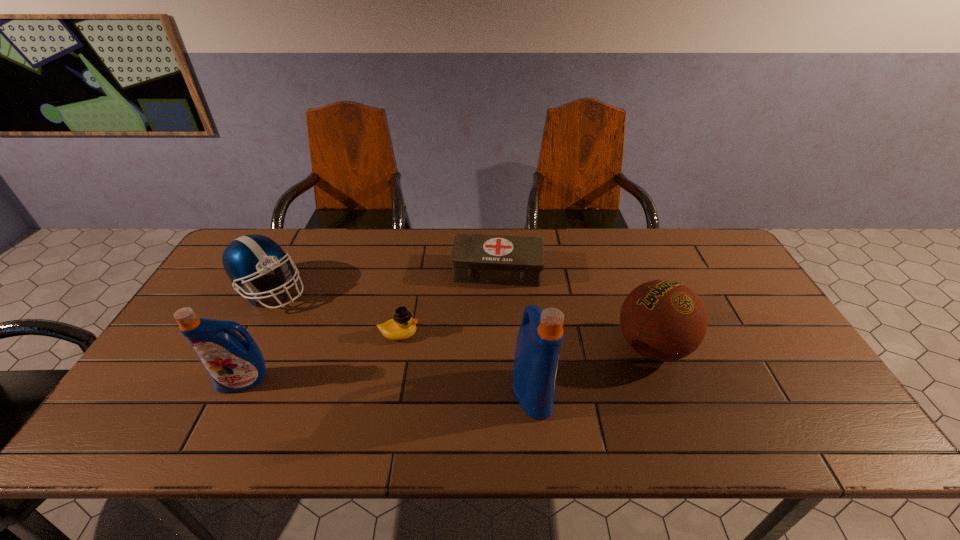
I want to click on vacant space located on the front-facing side of the duck, so click(511, 334).

Identify the location of free space located 0.090m at the front of the fourth tallest object with the faceguard. (339, 291).

The width and height of the screenshot is (960, 540). Identify the location of vacant space located on the left of the rightmost object. (509, 347).

Locate an element on the screen. This screenshot has width=960, height=540. the first-aid kit at the far edge is located at coordinates (480, 259).

At what (x,y) coordinates should I click in order to perform the action: click on football helmet located at the far edge. Please return your answer as a coordinate pair (x, y). Looking at the image, I should click on (248, 257).

What are the coordinates of `object that is positioned at the left edge` in the screenshot? It's located at (248, 257).

Where is `object that is at the far left corner`? object that is at the far left corner is located at coordinates (248, 257).

Where is `free space at the far edge`? The height and width of the screenshot is (540, 960). free space at the far edge is located at coordinates (397, 229).

Locate an element on the screen. free space at the near edge of the desktop is located at coordinates (218, 400).

This screenshot has height=540, width=960. I want to click on free space at the left edge of the desktop, so coord(236,311).